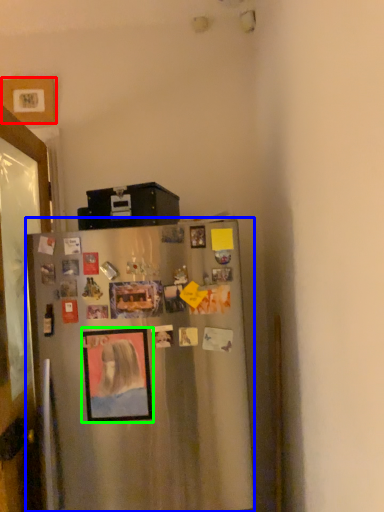
Question: Which object is the closest to the picture frame (highlighted by a red box)? Choose among these: refrigerator (highlighted by a blue box) or picture frame (highlighted by a green box).

Choices:
 (A) refrigerator
 (B) picture frame

Answer: (A)